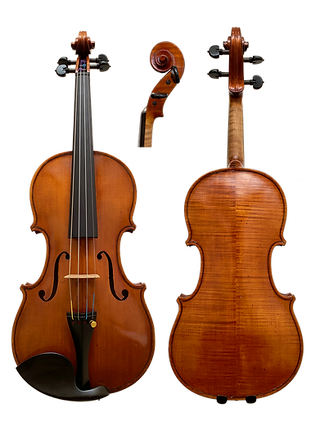
Locate an element on the screen. The image size is (320, 430). knob is located at coordinates (59, 72).